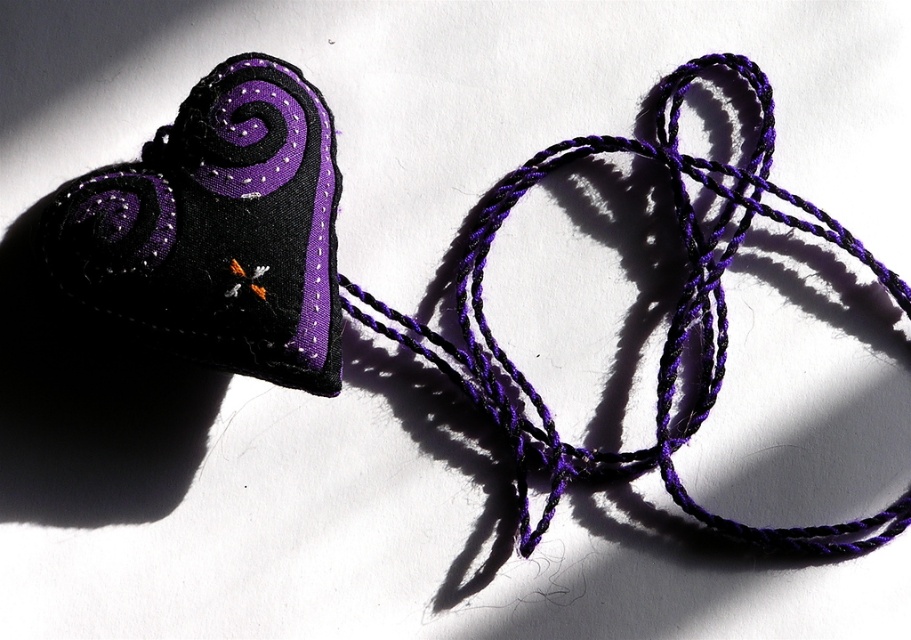
Question: Is matte black fabric heart at upper left further to the viewer compared to purple twisted string at center?

Choices:
 (A) no
 (B) yes

Answer: (A)

Question: Does matte black fabric heart at upper left have a lesser width compared to purple twisted string at center?

Choices:
 (A) yes
 (B) no

Answer: (A)

Question: Which point is closer to the camera taking this photo?

Choices:
 (A) (674, 154)
 (B) (268, 333)

Answer: (B)

Question: Among these points, which one is farthest from the camera?

Choices:
 (A) (764, 144)
 (B) (275, 252)

Answer: (A)

Question: Which object appears closest to the camera in this image?

Choices:
 (A) matte black fabric heart at upper left
 (B) purple twisted string at center

Answer: (A)

Question: Can you confirm if matte black fabric heart at upper left is thinner than purple twisted string at center?

Choices:
 (A) yes
 (B) no

Answer: (A)